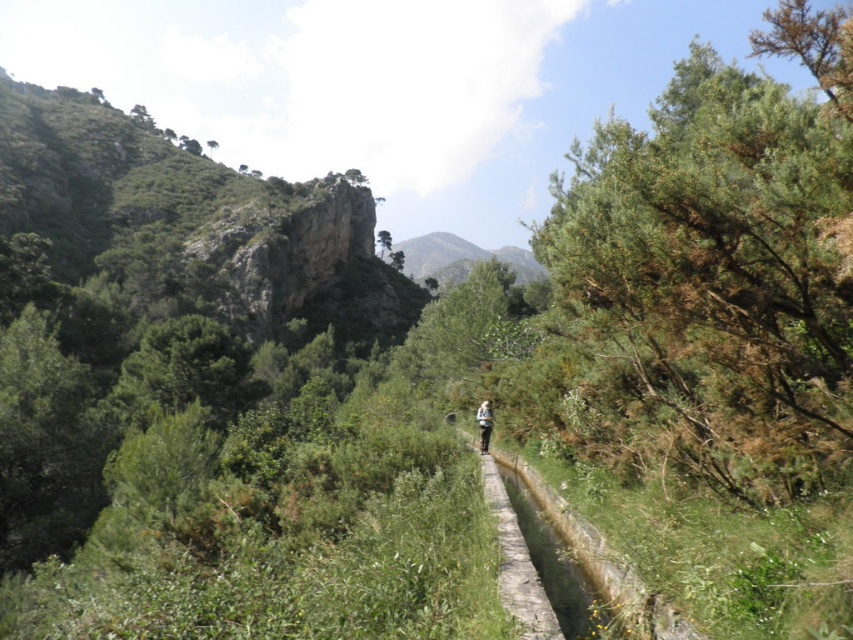
Question: Which of the following is the farthest from the observer?

Choices:
 (A) (825, 163)
 (B) (486, 445)

Answer: (B)

Question: Does green leafy tree at right appear on the left side of light brown fabric backpack at center?

Choices:
 (A) no
 (B) yes

Answer: (A)

Question: Which point appears closest to the camera in this image?

Choices:
 (A) (33, 161)
 (B) (741, 184)

Answer: (B)

Question: Which point appears farthest from the camera in this image?

Choices:
 (A) (x=115, y=144)
 (B) (x=640, y=346)

Answer: (A)

Question: Is green leafy tree at right below light brown fabric backpack at center?

Choices:
 (A) no
 (B) yes

Answer: (A)

Question: Is green leafy tree at right bigger than light brown fabric backpack at center?

Choices:
 (A) yes
 (B) no

Answer: (A)